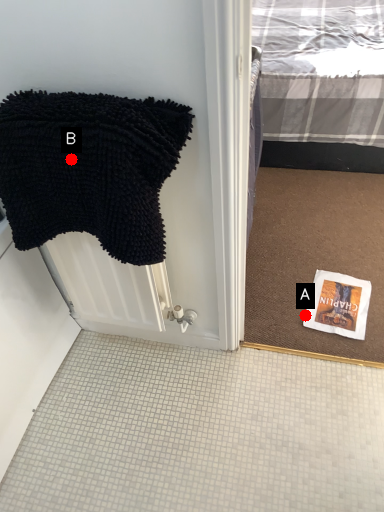
Question: Two points are circled on the image, labeled by A and B beside each circle. Which point is closer to the camera taking this photo?

Choices:
 (A) A is closer
 (B) B is closer

Answer: (B)